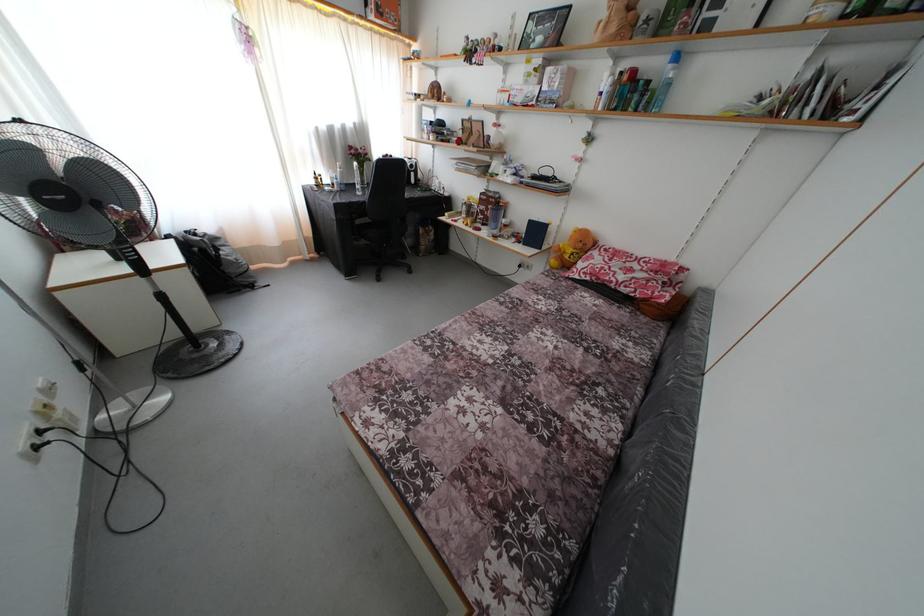
The image size is (924, 616). In order to click on yellow teddy bear in this screenshot , I will do `click(572, 249)`.